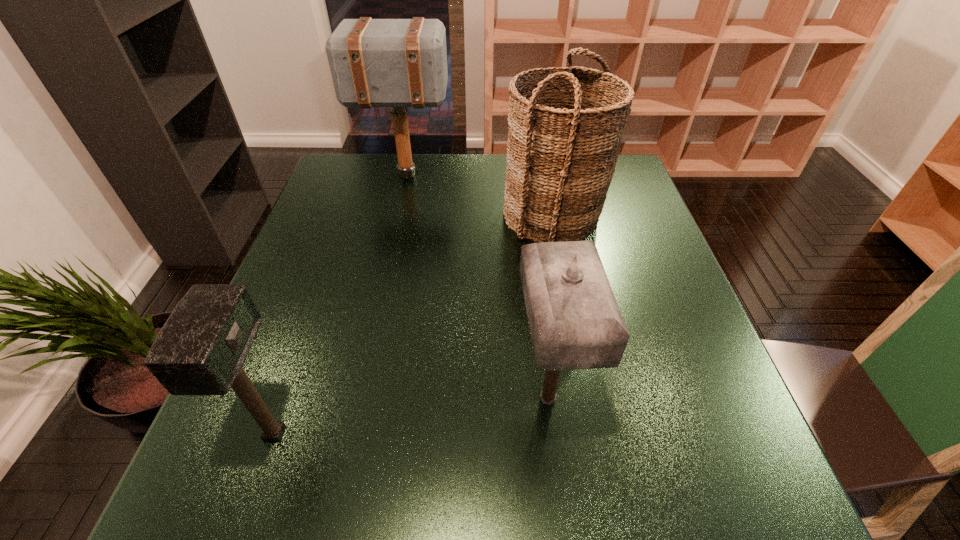
At what (x,y) coordinates should I click in order to perform the action: click on the third closest object relative to the basket. Please return your answer as a coordinate pair (x, y). Looking at the image, I should click on (200, 350).

Find the location of a particular element. This screenshot has width=960, height=540. the second closest object to the basket is located at coordinates (x=575, y=323).

Locate an element on the screen. This screenshot has width=960, height=540. mallet that is the closest to the rightmost mallet is located at coordinates (200, 350).

Select which mallet is the second closest to the shortest object. Please provide its 2D coordinates. Your answer should be formatted as a tuple, i.e. [(x, y)], where the tuple contains the x and y coordinates of a point satisfying the conditions above.

[(398, 63)]

Find the location of a particular element. This screenshot has height=540, width=960. free space that satisfies the following two spatial constraints: 1. on the striking surface of the farthest mallet; 2. on the right side of the rightmost mallet is located at coordinates (357, 399).

What are the coordinates of `free space in the image that satisfies the following two spatial constraints: 1. on the striking surface of the rightmost mallet; 2. on the left side of the farthest mallet` in the screenshot? It's located at (357, 399).

This screenshot has height=540, width=960. I want to click on vacant point that satisfies the following two spatial constraints: 1. on the striking surface of the basket; 2. on the left side of the farthest mallet, so tap(397, 215).

This screenshot has width=960, height=540. In order to click on free space that satisfies the following two spatial constraints: 1. on the striking surface of the farthest mallet; 2. on the left side of the basket in this screenshot , I will do `click(397, 215)`.

What are the coordinates of `free space in the image that satisfies the following two spatial constraints: 1. on the back side of the rightmost mallet; 2. on the right side of the basket` in the screenshot? It's located at (526, 215).

At what (x,y) coordinates should I click in order to perform the action: click on blank area in the image that satisfies the following two spatial constraints: 1. on the striking surface of the farthest mallet; 2. on the right side of the rightmost mallet. Please return your answer as a coordinate pair (x, y). Looking at the image, I should click on (357, 399).